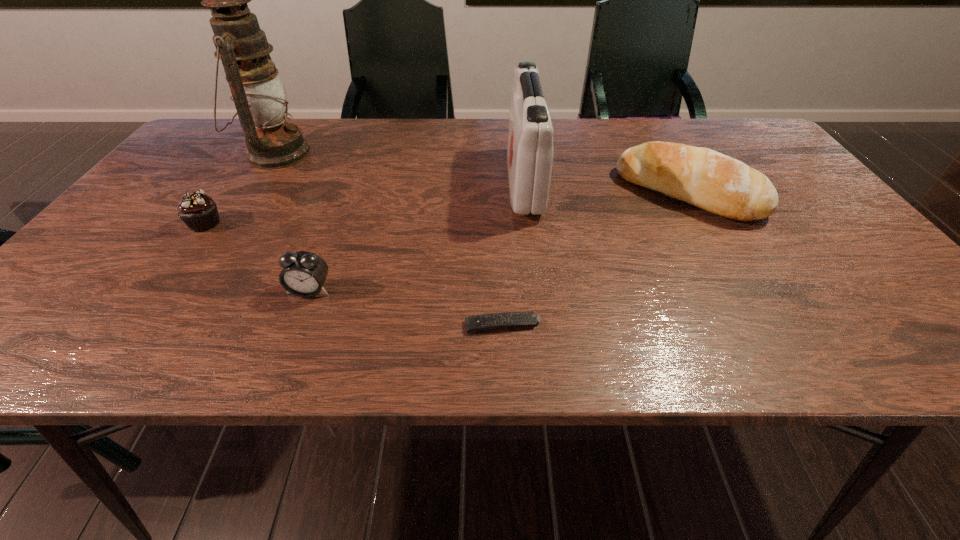
Where is `the tallest object`? This screenshot has width=960, height=540. the tallest object is located at coordinates (258, 94).

Find the location of a particular element. The width and height of the screenshot is (960, 540). the first-aid kit is located at coordinates point(530,151).

This screenshot has width=960, height=540. Identify the location of the rightmost object. (717, 183).

The image size is (960, 540). Identify the location of bread. (717, 183).

Where is `the fifth farthest object`? The image size is (960, 540). the fifth farthest object is located at coordinates (303, 274).

The image size is (960, 540). Identify the location of alarm clock. (303, 274).

Identify the location of cupcake. Image resolution: width=960 pixels, height=540 pixels. (198, 211).

Locate an element on the screen. The image size is (960, 540). the nearest object is located at coordinates (483, 322).

I want to click on remote control, so click(483, 322).

The image size is (960, 540). I want to click on free space located 0.380m on the front of the lantern, so click(x=193, y=283).